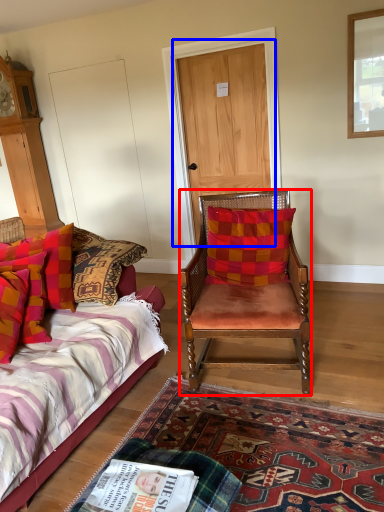
Question: Which object is closer to the camera taking this photo, chair (highlighted by a red box) or door (highlighted by a blue box)?

Choices:
 (A) chair
 (B) door

Answer: (A)